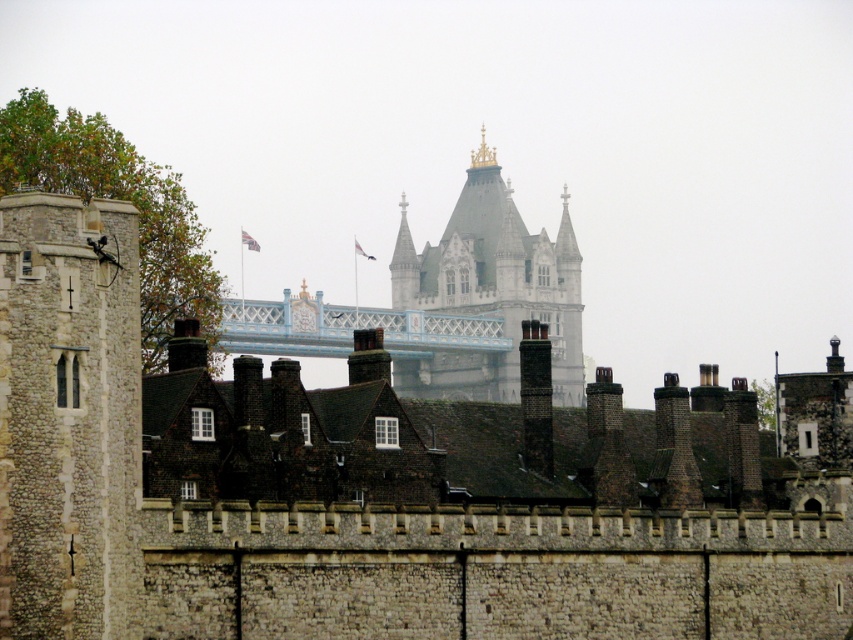
Question: From the image, what is the correct spatial relationship of white stone tower at center in relation to light blue painted metal bridge at center?

Choices:
 (A) below
 (B) above

Answer: (B)

Question: Is white stone tower at center below light blue painted metal bridge at center?

Choices:
 (A) yes
 (B) no

Answer: (B)

Question: Which object appears farthest from the camera in this image?

Choices:
 (A) white stone tower at center
 (B) light blue painted metal bridge at center

Answer: (A)

Question: Which of the following is the farthest from the observer?

Choices:
 (A) (473, 326)
 (B) (561, 396)

Answer: (A)

Question: Which object appears closest to the camera in this image?

Choices:
 (A) white stone tower at center
 (B) light blue painted metal bridge at center

Answer: (B)

Question: Is white stone tower at center smaller than light blue painted metal bridge at center?

Choices:
 (A) no
 (B) yes

Answer: (A)